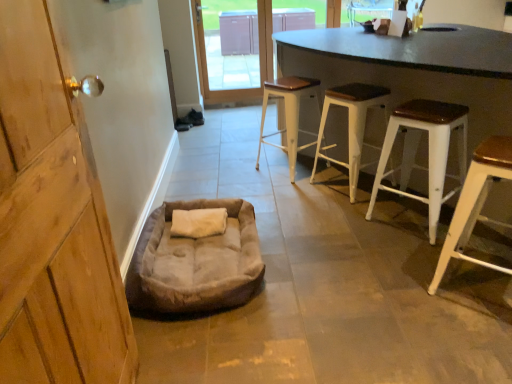
Question: Does wooden door handle at left have a larger size compared to black matte table at center?

Choices:
 (A) no
 (B) yes

Answer: (A)

Question: From the image's perspective, is wooden door handle at left under black matte table at center?

Choices:
 (A) no
 (B) yes

Answer: (B)

Question: Does wooden door handle at left have a lesser width compared to black matte table at center?

Choices:
 (A) yes
 (B) no

Answer: (A)

Question: From the image's perspective, is wooden door handle at left on top of black matte table at center?

Choices:
 (A) yes
 (B) no

Answer: (B)

Question: Is wooden door handle at left facing towards black matte table at center?

Choices:
 (A) yes
 (B) no

Answer: (B)

Question: Is the depth of wooden door handle at left greater than that of black matte table at center?

Choices:
 (A) no
 (B) yes

Answer: (A)

Question: Are white metal stool at center, placed as the 4th stool when sorted from front to back, and white wood stool at right, which is counted as the fourth stool, starting from the back, far apart?

Choices:
 (A) yes
 (B) no

Answer: (A)

Question: Can you confirm if white metal stool at center, the 1th stool viewed from the back, is positioned to the left of white wood stool at right, which is counted as the fourth stool, starting from the back?

Choices:
 (A) no
 (B) yes

Answer: (B)

Question: Is white metal stool at center, placed as the 4th stool when sorted from front to back, aimed at white wood stool at right, which is counted as the fourth stool, starting from the back?

Choices:
 (A) no
 (B) yes

Answer: (A)

Question: From the image's perspective, is white metal stool at center, placed as the 4th stool when sorted from front to back, under white wood stool at right, placed as the 1th stool when sorted from front to back?

Choices:
 (A) no
 (B) yes

Answer: (A)

Question: From a real-world perspective, is white metal stool at center, placed as the 4th stool when sorted from front to back, located beneath white wood stool at right, placed as the 1th stool when sorted from front to back?

Choices:
 (A) no
 (B) yes

Answer: (B)

Question: Is the depth of white metal stool at center, the 1th stool viewed from the back, greater than that of white wood stool at right, which is counted as the fourth stool, starting from the back?

Choices:
 (A) yes
 (B) no

Answer: (A)

Question: Could you tell me if transparent glass door at upper center is turned towards wooden door handle at left?

Choices:
 (A) yes
 (B) no

Answer: (A)